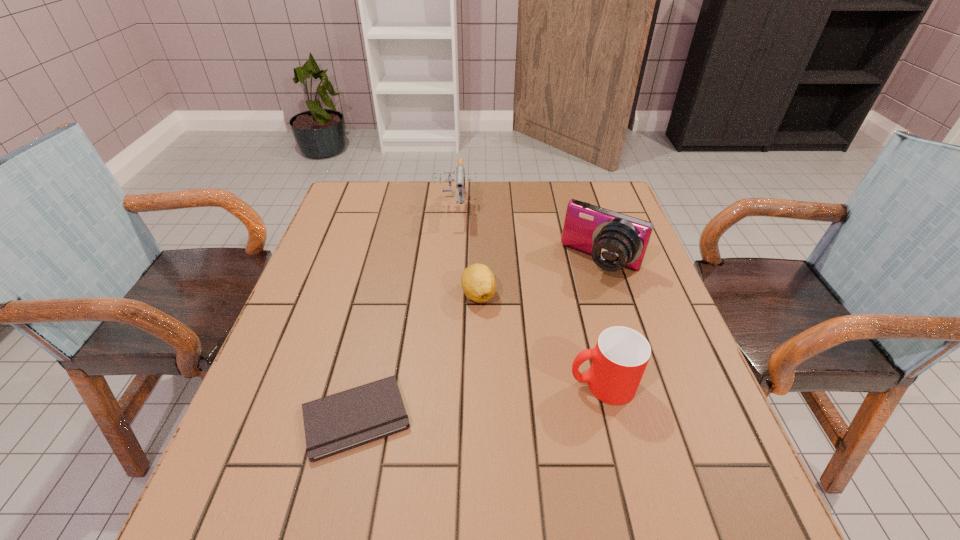
This screenshot has width=960, height=540. What are the coordinates of `checkbook` in the screenshot? It's located at coord(336,423).

The image size is (960, 540). I want to click on cup, so point(619,359).

Locate an element on the screen. This screenshot has height=540, width=960. lemon is located at coordinates (478, 283).

Identify the location of gun. The image size is (960, 540). (460, 177).

Identify the location of camera. The width and height of the screenshot is (960, 540). (614, 240).

Where is `free spot located 0.310m on the back of the shortest object`? The image size is (960, 540). free spot located 0.310m on the back of the shortest object is located at coordinates (388, 276).

In order to click on free region located 0.220m on the side of the cup with the handle in this screenshot , I will do `click(458, 385)`.

Find the location of `vacant area located on the side of the cup with the handle`. vacant area located on the side of the cup with the handle is located at coordinates (539, 385).

The width and height of the screenshot is (960, 540). I want to click on vacant space located 0.230m on the side of the cup with the handle, so click(453, 385).

What are the coordinates of `vacant space located 0.080m at the stem end of the lemon` in the screenshot? It's located at (471, 338).